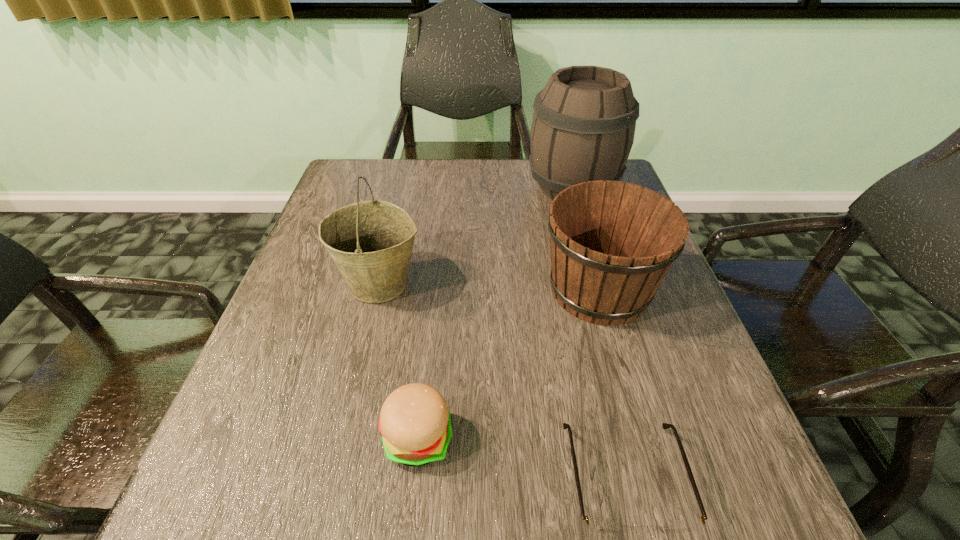
Identify the location of object that is at the left edge. (371, 242).

Locate an element on the screen. Image resolution: width=960 pixels, height=540 pixels. object situated at the far right corner is located at coordinates (583, 127).

In the image, there is a desktop. At what (x,y) coordinates should I click in order to perform the action: click on vacant area at the far edge. Please return your answer as a coordinate pair (x, y). Looking at the image, I should click on (446, 183).

This screenshot has height=540, width=960. In order to click on blank space at the near edge of the desktop in this screenshot , I will do `click(427, 501)`.

You are a GUI agent. You are given a task and a screenshot of the screen. Output one action in this format:
    pyautogui.click(x=<x>, y=<y>)
    Task: Click on the vacant area at the left edge
    Image resolution: width=960 pixels, height=540 pixels.
    Given the screenshot: What is the action you would take?
    pyautogui.click(x=289, y=426)

Locate an element on the screen. free space at the right edge is located at coordinates (728, 401).

The image size is (960, 540). I want to click on vacant region at the far left corner of the desktop, so click(350, 173).

Find the location of a particular element. The width and height of the screenshot is (960, 540). vacant space at the near left corner of the desktop is located at coordinates (259, 524).

Where is `empty space between the leftmost wine bucket and the second shortest object`? This screenshot has width=960, height=540. empty space between the leftmost wine bucket and the second shortest object is located at coordinates (398, 361).

The image size is (960, 540). Find the location of `free space between the leftmost wine bucket and the third tallest object`. free space between the leftmost wine bucket and the third tallest object is located at coordinates (490, 287).